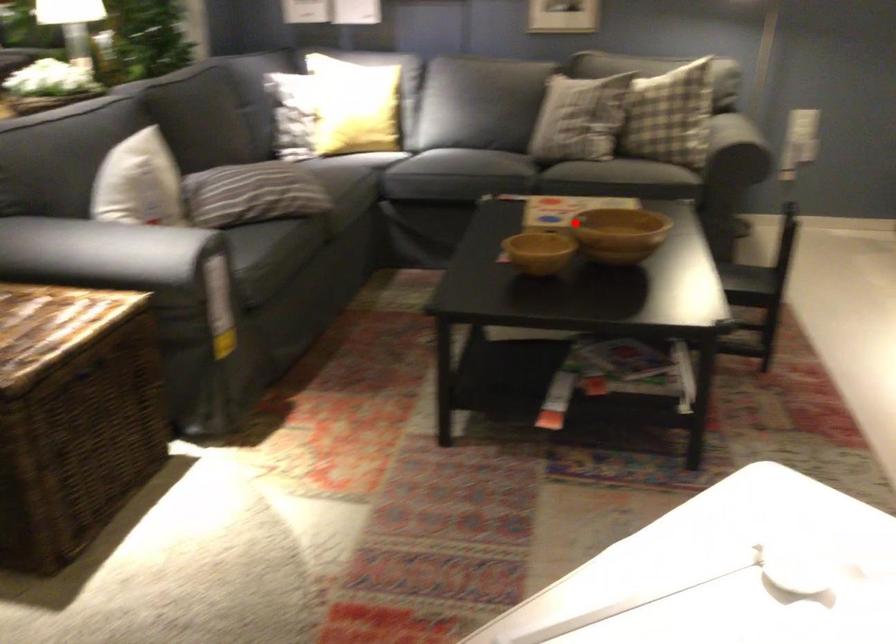
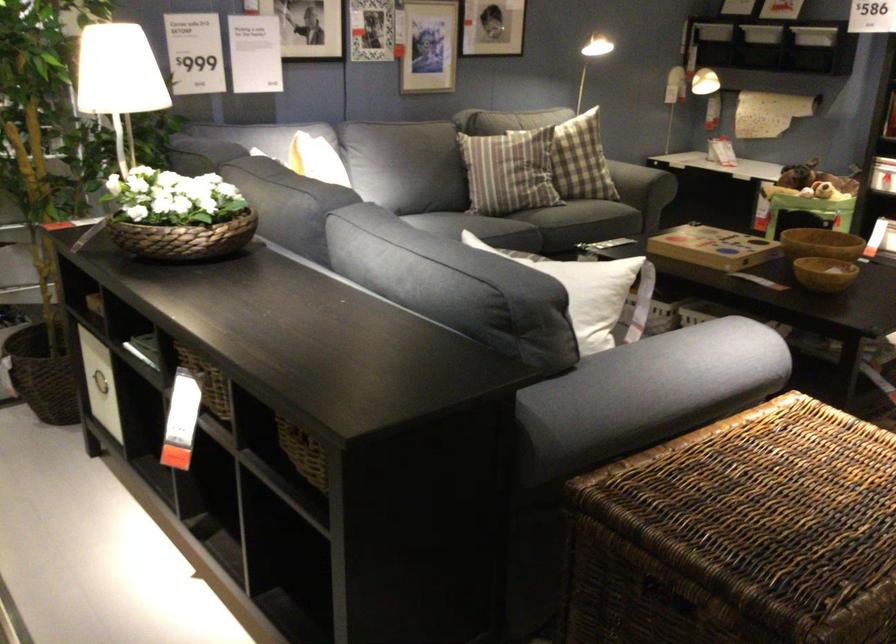
Find the pixel in the second image that matches the highlighted location in the first image.

(821, 243)